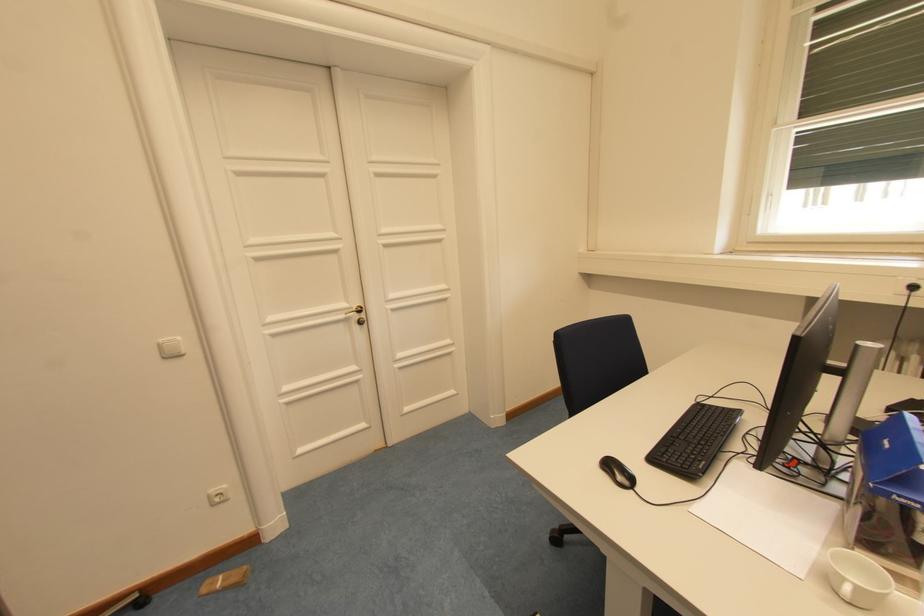
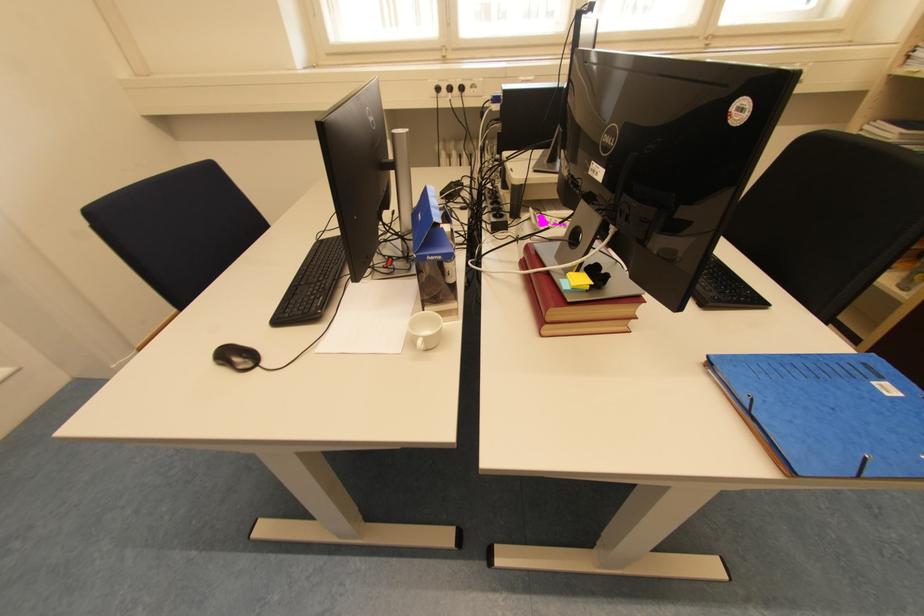
Where in the second image is the point corresponding to pixel 634 485 from the first image?

(256, 365)